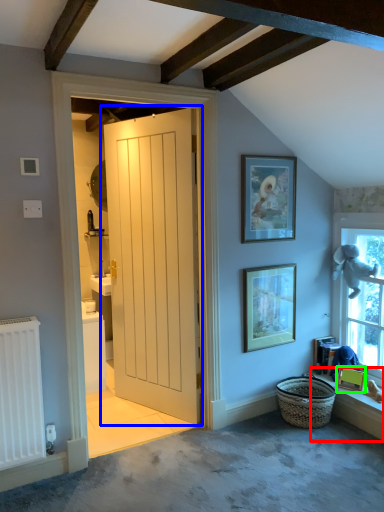
Question: Which object is positioned farthest from window sill (highlighted by a red box)? Select from door (highlighted by a blue box) and picture frame (highlighted by a green box).

Choices:
 (A) door
 (B) picture frame

Answer: (A)